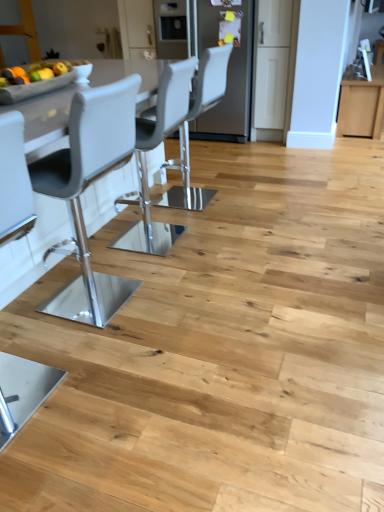
Where is `vacant space to the right of matte gray chair at center, acting as the first chair starting from the right`? vacant space to the right of matte gray chair at center, acting as the first chair starting from the right is located at coordinates (249, 197).